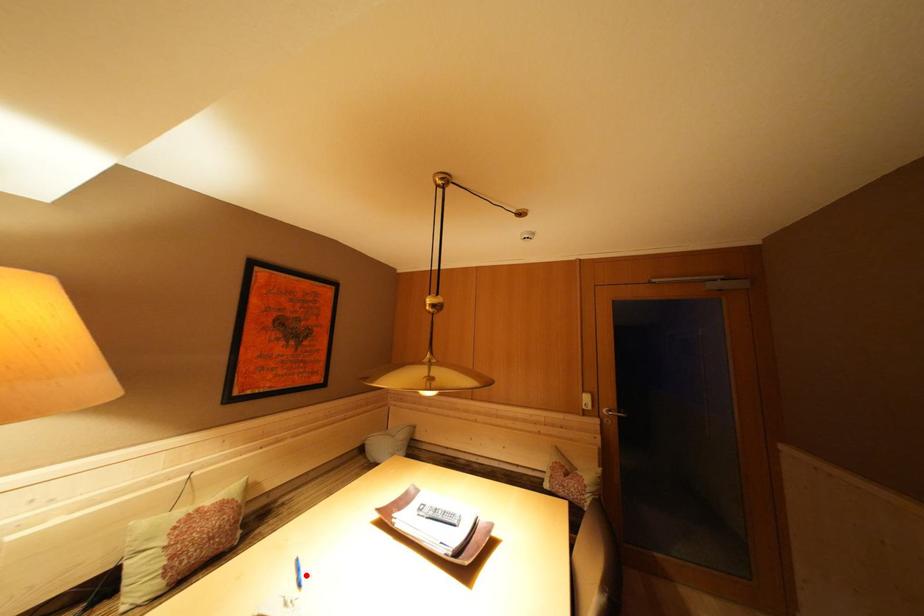
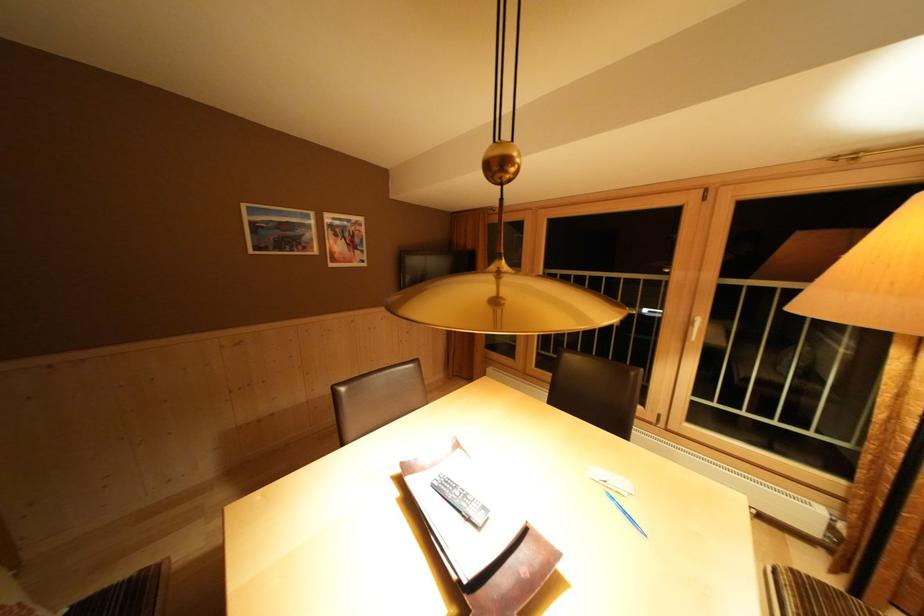
In the second image, find the point that corresponds to the highlighted location in the first image.

(633, 517)